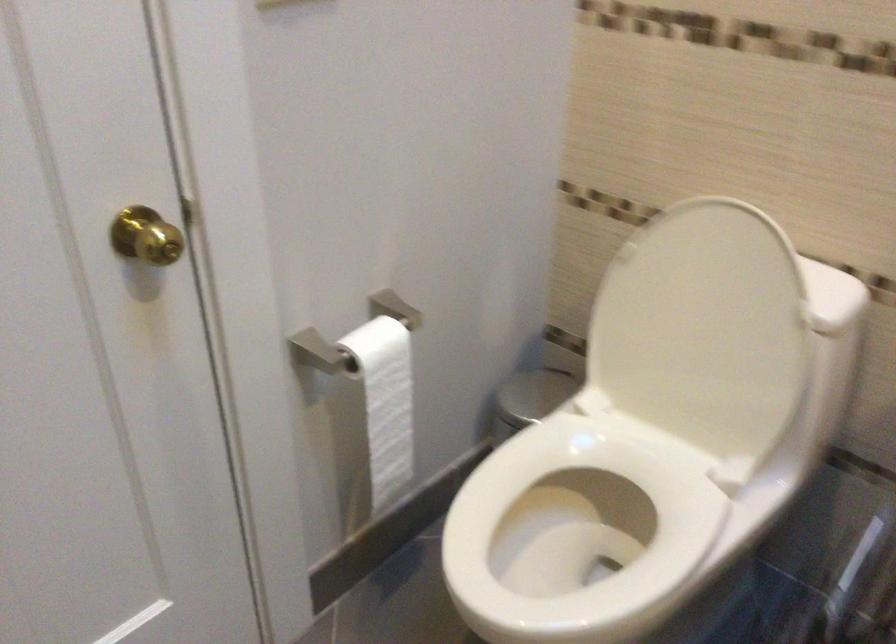
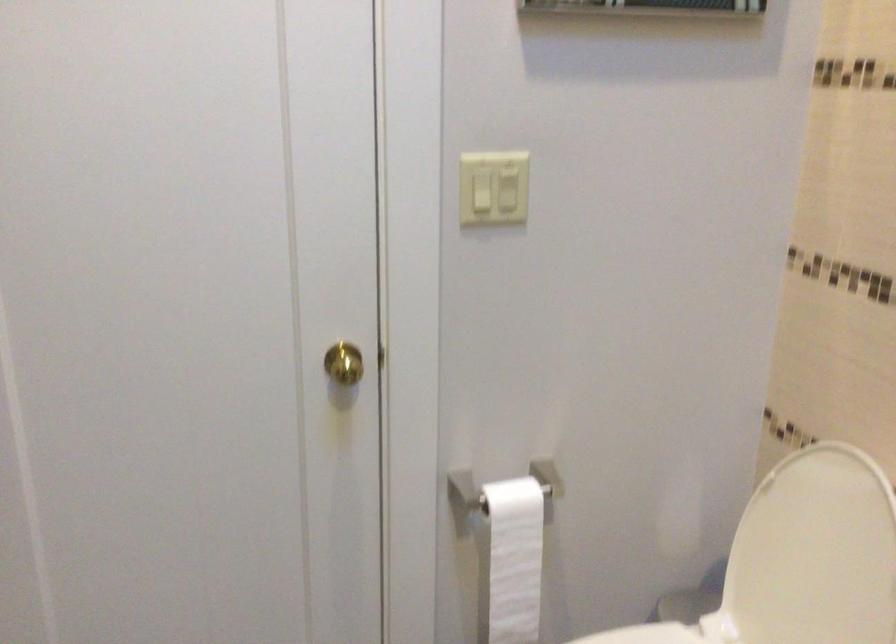
The point at (539, 436) is marked in the first image. Where is the corresponding point in the second image?

(645, 635)